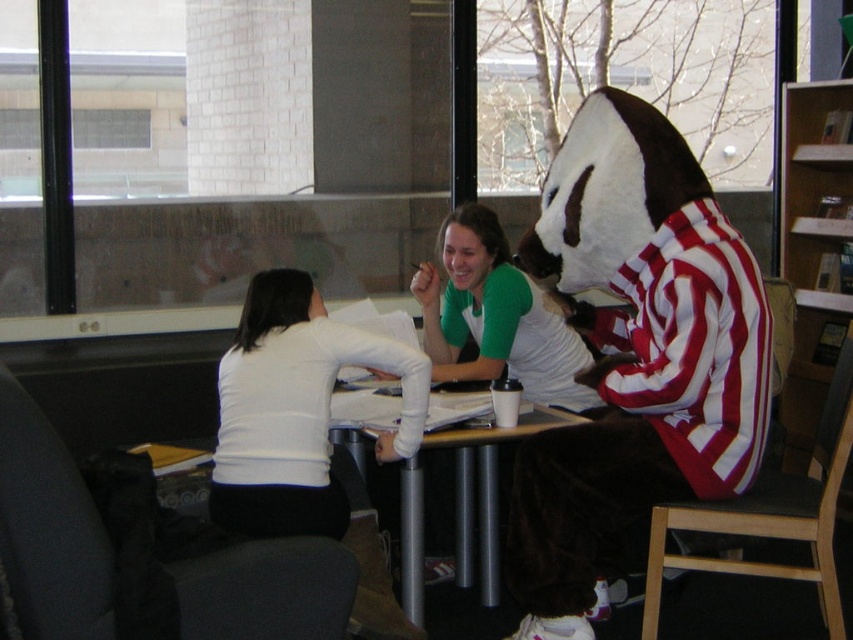
You are sitting at the wooden bookshelf at upper right and want to move to the black fabric chair at left. Which direction should you move to reach it?

You should move to the left to reach the black fabric chair at left since it is positioned to the left of the wooden bookshelf at upper right.

In the scene shown: You are standing at the center of the room and want to move to the black fabric chair at left. Which direction should you walk towards?

The black fabric chair at left is located at point (x=48, y=528), so you should walk towards the left side of the room to reach it.

You are organizing a small event and need to determine seating arrangements. Given the white matte shirt at center and the black fabric chair at lower right, which object takes up more space in the scene?

The black fabric chair at lower right takes up more space in the scene than the white matte shirt at center, as the white matte shirt at center occupies less space than black fabric chair at lower right.